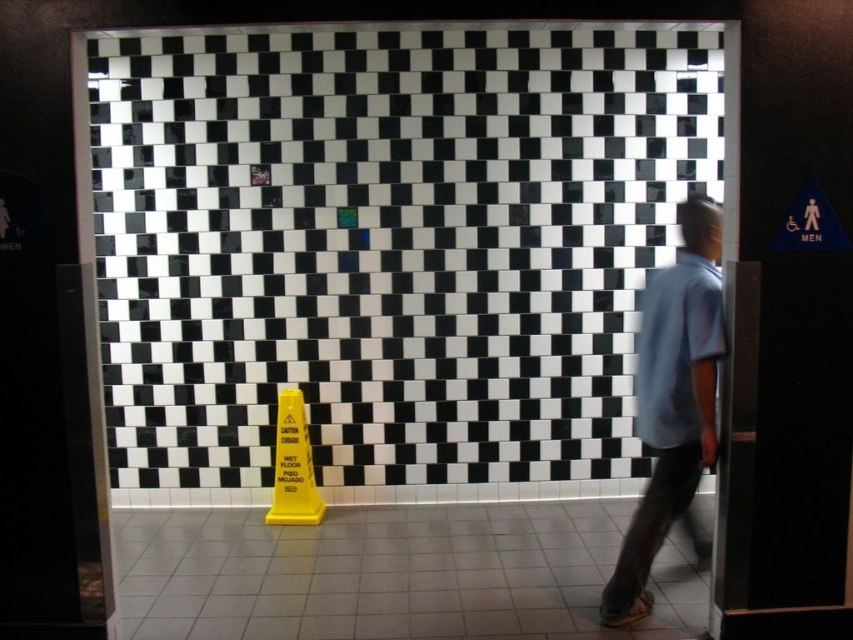
From the picture: You are a maintenance worker checking the floor tiles in the restroom. You notice the black glossy tile at center and the white tile at lower center. Which tile has a bigger size?

The black glossy tile at center is larger in size than the white tile at lower center.

You are standing in the restroom and want to avoid the wet floor. The caution sign is triangular and has a warning symbol at the top. Where is the black glossy tile at center located?

The black glossy tile at center is located at point [387,250].